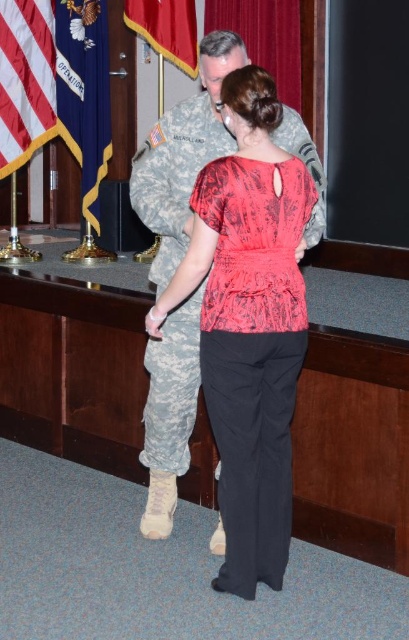
You are standing in the formal setting depicted. There are two points marked in the scene. Which point, point (267, 404) or point (191, 51), is closer to you?

Point (267, 404) is closer to the viewer than point (191, 51).

You are an interior designer assessing the layout of a formal event space. You notice the matte red blouse at center and the american flag at left. Based on their positions, which object should be placed higher on the wall to adhere to traditional decor standards?

The matte red blouse at center should be placed higher on the wall since it has a greater height compared to the american flag at left, aligning with traditional decor standards that prioritize taller objects in central positions.

You are an event planner arranging a photo shoot in this scene. You need to ensure the matte red blouse at center and the red velvet flag at upper left are visible in the frame. Which object should be placed higher to achieve this?

The red velvet flag at upper left should be placed higher since the matte red blouse at center is positioned under it, ensuring both are visible in the frame.